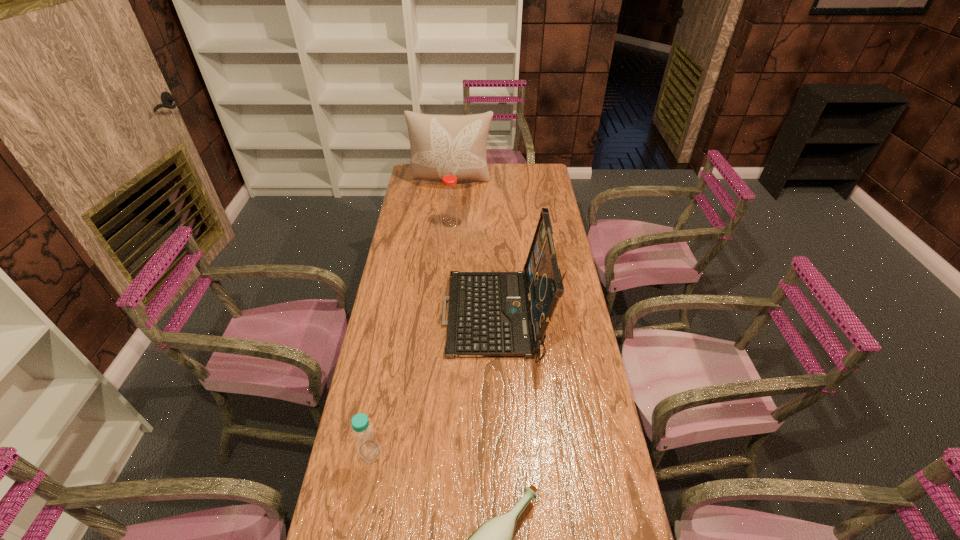
Identify the location of the farthest object. The image size is (960, 540). (441, 145).

This screenshot has height=540, width=960. Identify the location of the third nearest object. (491, 314).

Where is `the third shortest object`? the third shortest object is located at coordinates (450, 197).

This screenshot has height=540, width=960. In order to click on the second bottle from right to left in this screenshot , I will do `click(450, 197)`.

Find the location of `the leftmost bottle`. the leftmost bottle is located at coordinates (368, 447).

Locate an element on the screen. the fourth farthest object is located at coordinates (368, 447).

The height and width of the screenshot is (540, 960). I want to click on free location located on the front side of the cushion, so click(x=449, y=210).

Locate an element on the screen. free space located on the front-facing side of the laptop computer is located at coordinates (391, 318).

The width and height of the screenshot is (960, 540). Identify the location of vacant space situated 0.160m on the front-facing side of the laptop computer. (399, 318).

Locate an element on the screen. The width and height of the screenshot is (960, 540). vacant space located 0.080m on the front-facing side of the laptop computer is located at coordinates (421, 318).